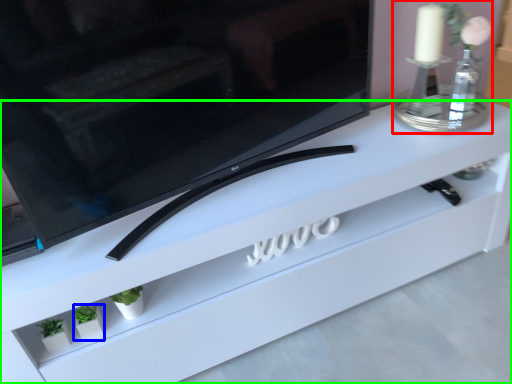
Question: Considering the real-world distances, which object is farthest from candle holder (highlighted by a red box)? plant (highlighted by a blue box) or furniture (highlighted by a green box)?

Choices:
 (A) plant
 (B) furniture

Answer: (A)